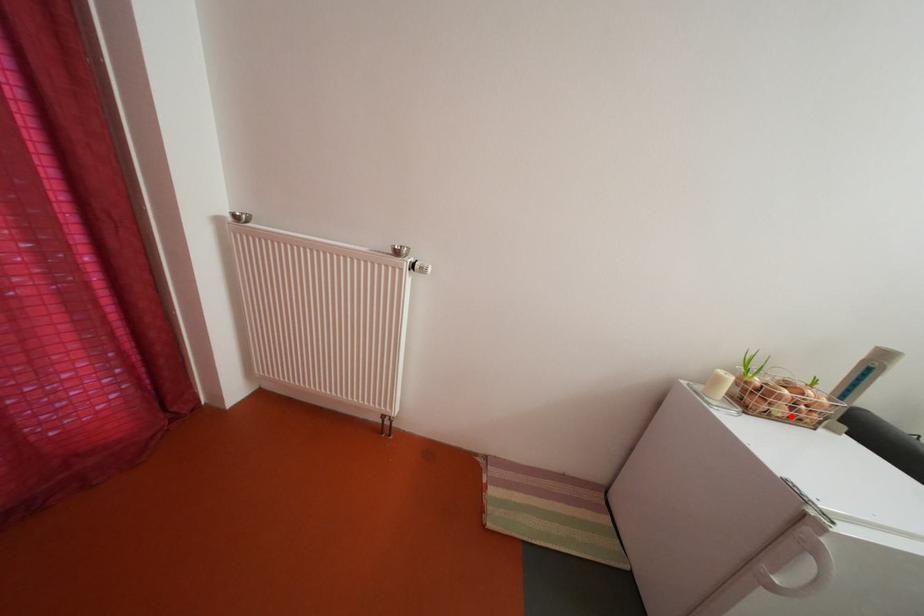
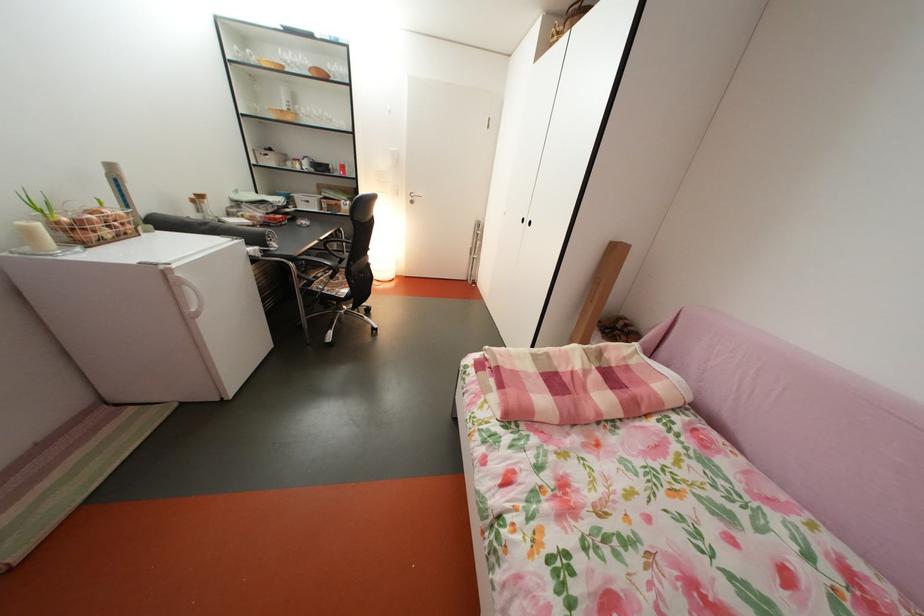
Where in the second image is the point corresponding to the highlighted location from the first image?

(118, 238)